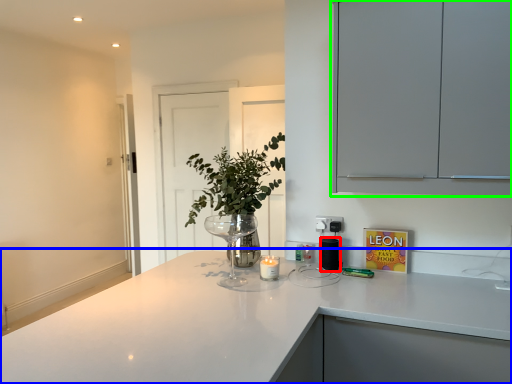
Question: Based on their relative distances, which object is nearer to appliance (highlighted by a red box)? Choose from countertop (highlighted by a blue box) and cabinetry (highlighted by a green box).

Choices:
 (A) countertop
 (B) cabinetry

Answer: (A)